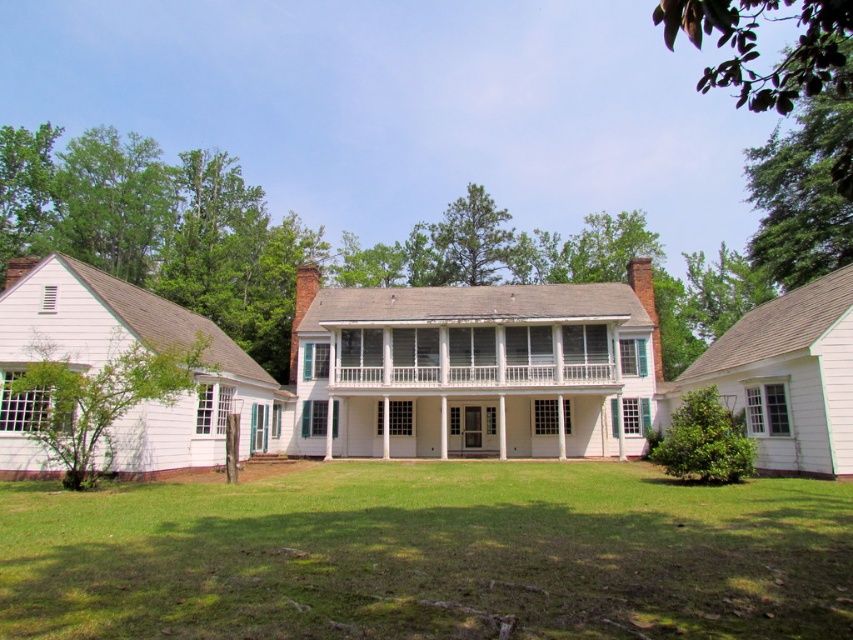
You are standing in front of the house and want to walk from the green grass at center to the white painted wood porch at center. Which direction should you walk to reach the porch?

The white painted wood porch at center is located at the front of the house, so you should walk towards the house to reach it.

Looking at this image, you are standing in the front yard of the house and want to walk to the white painted wood porch at center. Which direction should you move relative to the green grass at center?

You should move towards the white painted wood porch at center, which is behind the green grass at center. Since the green grass at center is in front of the porch, you need to walk backward away from the grass to reach the porch.

In the scene shown: You are standing in front of the house and want to walk to the green grass at center. Which direction should you move relative to the white painted wood porch at center?

To reach the green grass at center, you should move downward from the white painted wood porch at center since the green grass at center is located below it.